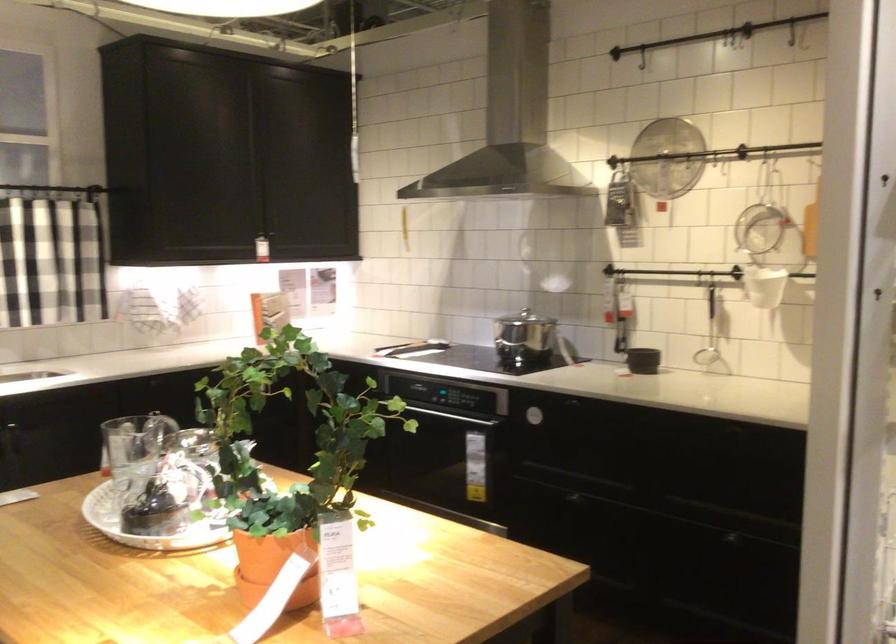
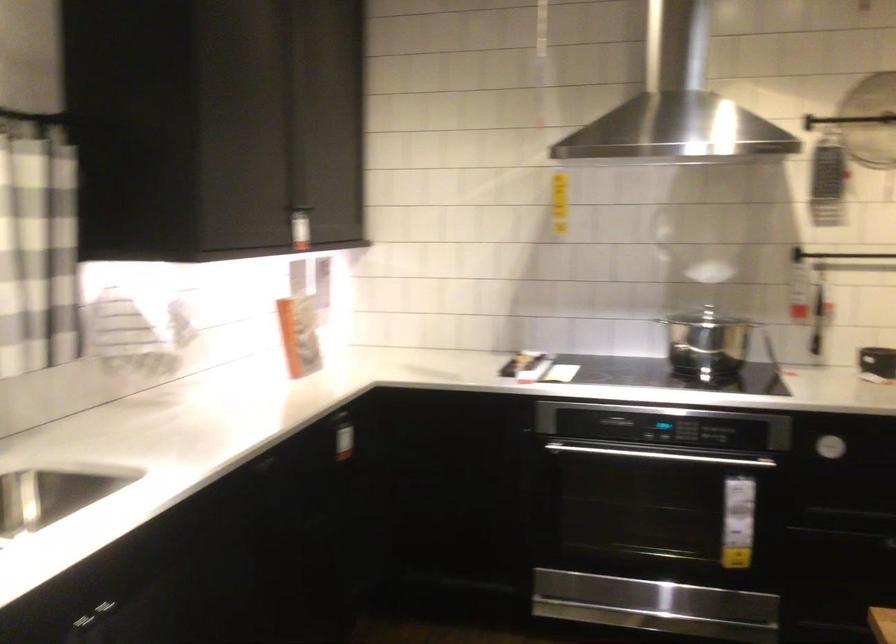
What movement of the cameraman would produce the second image?

The cameraman moved toward left, forward.